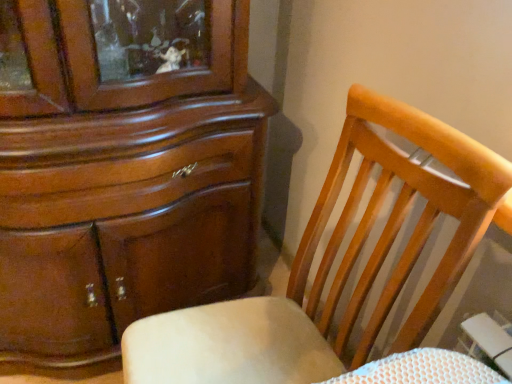
The height and width of the screenshot is (384, 512). What are the coordinates of `wooden chair at right` in the screenshot? It's located at (332, 263).

What do you see at coordinates (332, 263) in the screenshot? The height and width of the screenshot is (384, 512). I see `wooden chair at right` at bounding box center [332, 263].

At what (x,y) coordinates should I click in order to perform the action: click on wooden chair at right. Please return your answer as a coordinate pair (x, y). Looking at the image, I should click on (332, 263).